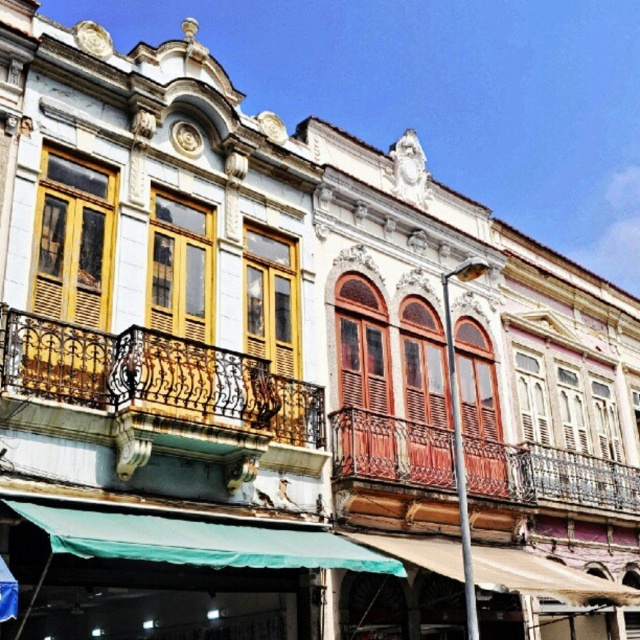
Question: Which object appears farthest from the camera in this image?

Choices:
 (A) rustic wood balcony at center
 (B) rusty metal balcony at left

Answer: (A)

Question: Does rusty metal balcony at left have a larger size compared to rustic wood balcony at center?

Choices:
 (A) no
 (B) yes

Answer: (A)

Question: Is rusty metal balcony at left positioned behind rustic wood balcony at center?

Choices:
 (A) no
 (B) yes

Answer: (A)

Question: Which of the following is the farthest from the observer?

Choices:
 (A) (536, 477)
 (B) (168, 394)

Answer: (A)

Question: Which object is closer to the camera taking this photo?

Choices:
 (A) rusty metal balcony at left
 (B) rustic wood balcony at center

Answer: (A)

Question: Is rusty metal balcony at left above rustic wood balcony at center?

Choices:
 (A) yes
 (B) no

Answer: (A)